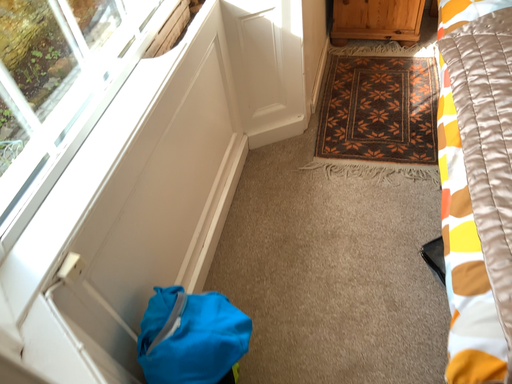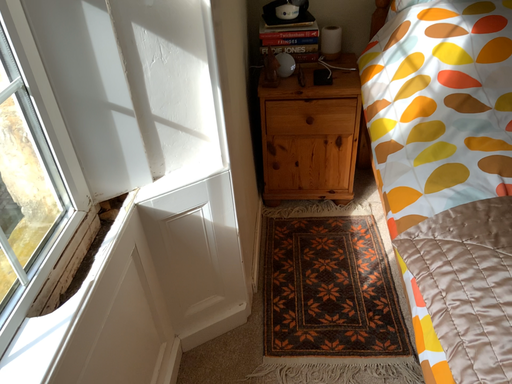
Question: How did the camera likely rotate when shooting the video?

Choices:
 (A) rotated right
 (B) rotated left

Answer: (A)